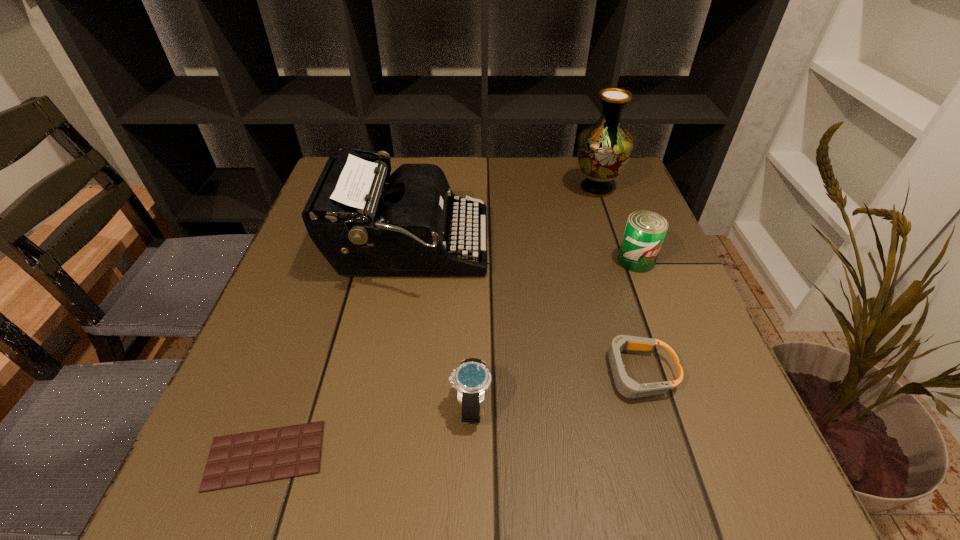
The height and width of the screenshot is (540, 960). Find the location of `vase`. vase is located at coordinates (604, 148).

Locate an element on the screen. the farthest object is located at coordinates (604, 148).

I want to click on the fifth shortest object, so click(362, 226).

Where is `can`? can is located at coordinates (645, 231).

The width and height of the screenshot is (960, 540). In order to click on the fourth tallest object in this screenshot , I will do `click(472, 379)`.

At what (x,y) coordinates should I click in order to perform the action: click on goggles. Please return your answer as a coordinate pair (x, y). This screenshot has height=540, width=960. Looking at the image, I should click on (626, 386).

This screenshot has width=960, height=540. Identify the location of chocolate bar. (248, 458).

Where is `free space located 0.070m on the back of the vase`? The image size is (960, 540). free space located 0.070m on the back of the vase is located at coordinates click(x=588, y=162).

You are a GUI agent. You are given a task and a screenshot of the screen. Output one action in this format:
    pyautogui.click(x=<x>, y=<y>)
    Task: Click on the free region located 0.350m on the typing side of the typewriter
    The image size is (960, 540).
    Given the screenshot: What is the action you would take?
    pyautogui.click(x=643, y=247)

The width and height of the screenshot is (960, 540). In order to click on vacant space located on the front of the third tallest object in this screenshot , I will do `click(689, 401)`.